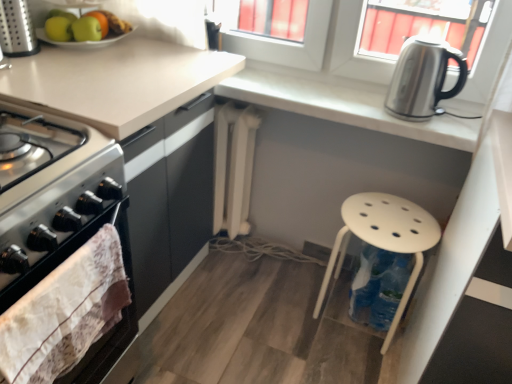
Image resolution: width=512 pixels, height=384 pixels. I want to click on unoccupied region to the right of green matte apple at upper left, so click(154, 42).